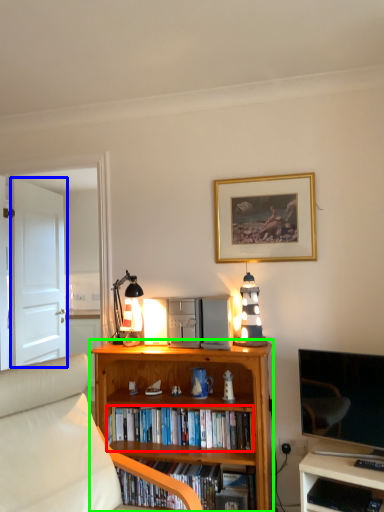
Question: Estimate the real-world distances between objects in this image. Which object is farther from book (highlighted by a red box), door (highlighted by a blue box) or bookcase (highlighted by a green box)?

Choices:
 (A) door
 (B) bookcase

Answer: (A)